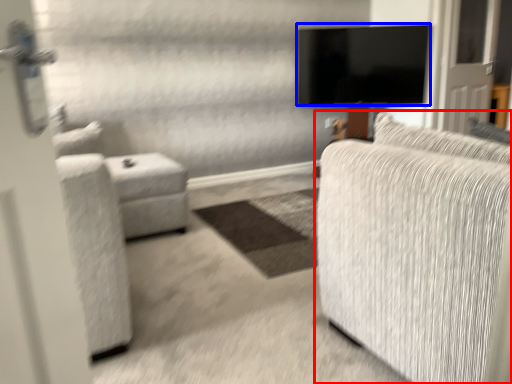
Question: Which point is further to the camera, studio couch (highlighted by a red box) or television (highlighted by a blue box)?

Choices:
 (A) studio couch
 (B) television

Answer: (B)